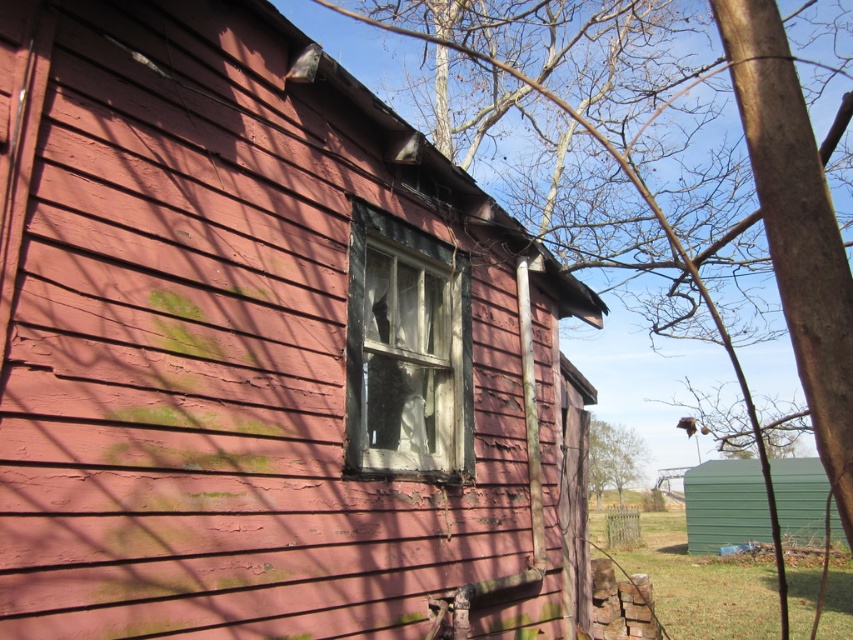
From the picture: You are a delivery person trying to deliver a package to the transparent glass window at center. However, there is a green corrugated metal hut at lower right blocking your path. Can you still reach the window without moving the hut?

The transparent glass window at center has a smaller size compared to green corrugated metal hut at lower right. Since the window is smaller, it might be positioned higher or in a location that isn

You are a painter standing in front of the building. You want to paint the green corrugated metal hut at lower right but need to avoid spraying paint on the transparent glass window at center. Which object should you move closer to, and which should you stay away from?

You should move closer to the green corrugated metal hut at lower right and stay away from the transparent glass window at center since the transparent glass window at center is in front of the green corrugated metal hut at lower right.

You are a painter assessing the building for repairs. You need to know which object, the transparent glass window at center or the green leafy tree at center, requires immediate attention based on their sizes. Which one should you prioritize?

The transparent glass window at center has a smaller size compared to the green leafy tree at center. Since the window is smaller, it might be easier to repair first, so prioritize the transparent glass window at center.